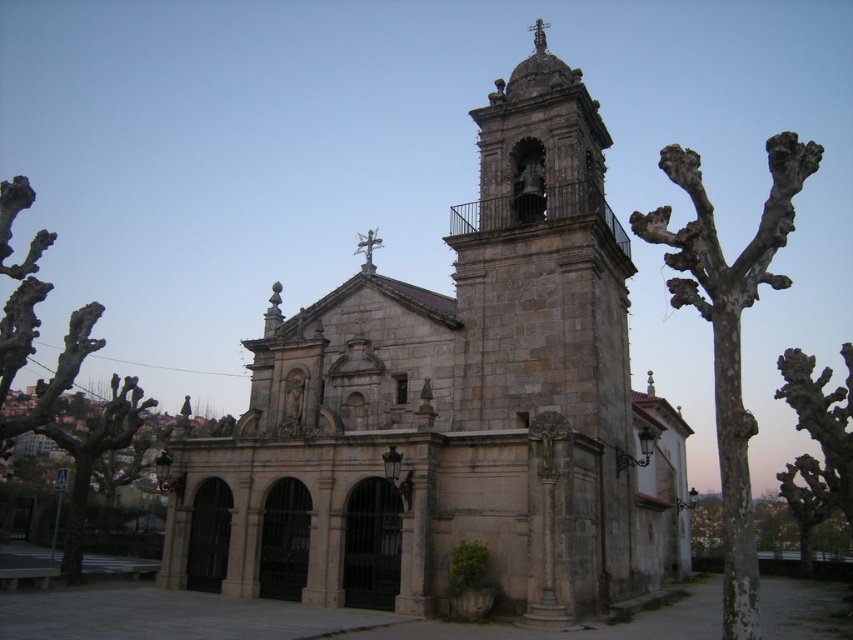
Question: Which object is farther from the camera taking this photo?

Choices:
 (A) stone church at center
 (B) polished stone cross at center
 (C) bare branches at left
 (D) bare wood tree at right

Answer: (B)

Question: Is stone church at center to the right of bare branches at left from the viewer's perspective?

Choices:
 (A) yes
 (B) no

Answer: (A)

Question: Which of the following is the farthest from the observer?

Choices:
 (A) (740, 433)
 (B) (57, 387)

Answer: (B)

Question: Can you confirm if stone church at center is bigger than bare wood tree at right?

Choices:
 (A) yes
 (B) no

Answer: (A)

Question: Which of these objects is positioned closest to the stone church at center?

Choices:
 (A) bare branches at left
 (B) bare wood tree at right

Answer: (B)

Question: Can you confirm if bare branches at left is positioned below polished stone cross at center?

Choices:
 (A) yes
 (B) no

Answer: (A)